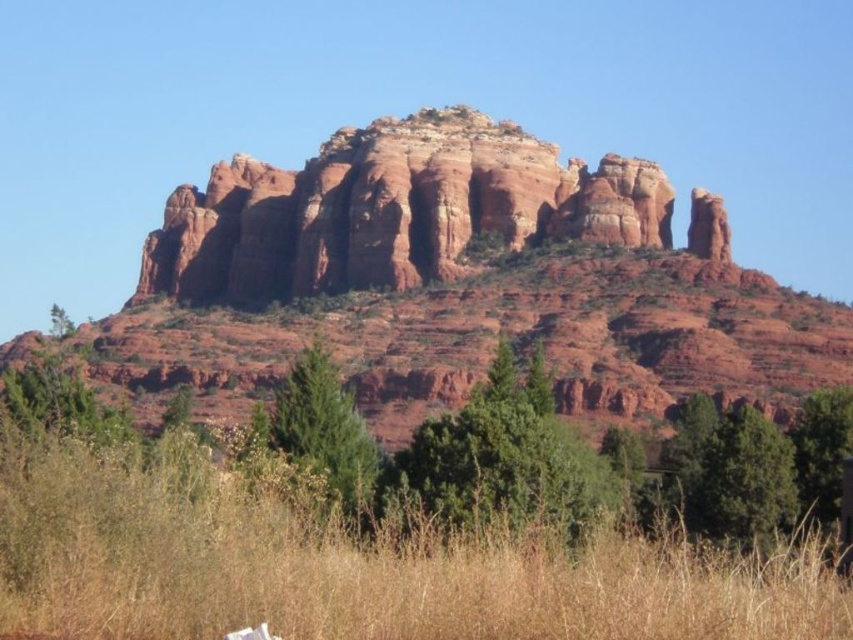
Question: From the image, what is the correct spatial relationship of dry grass at lower center in relation to reddish-brown rock formation at center?

Choices:
 (A) right
 (B) left

Answer: (A)

Question: Is dry grass at lower center positioned in front of reddish-brown rock formation at center?

Choices:
 (A) no
 (B) yes

Answer: (B)

Question: Which of the following is the closest to the observer?

Choices:
 (A) dry grass at lower center
 (B) reddish-brown rock formation at center

Answer: (A)

Question: Which point is farther from the camera taking this photo?

Choices:
 (A) (144, 616)
 (B) (659, 180)

Answer: (B)

Question: Considering the relative positions of dry grass at lower center and reddish-brown rock formation at center in the image provided, where is dry grass at lower center located with respect to reddish-brown rock formation at center?

Choices:
 (A) above
 (B) below

Answer: (B)